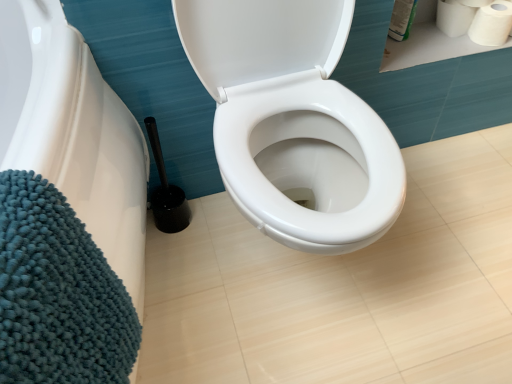
Find the location of a particular element. space that is in front of white matte toilet paper at upper right, marked as the 2th toilet paper in a right-to-left arrangement is located at coordinates (448, 44).